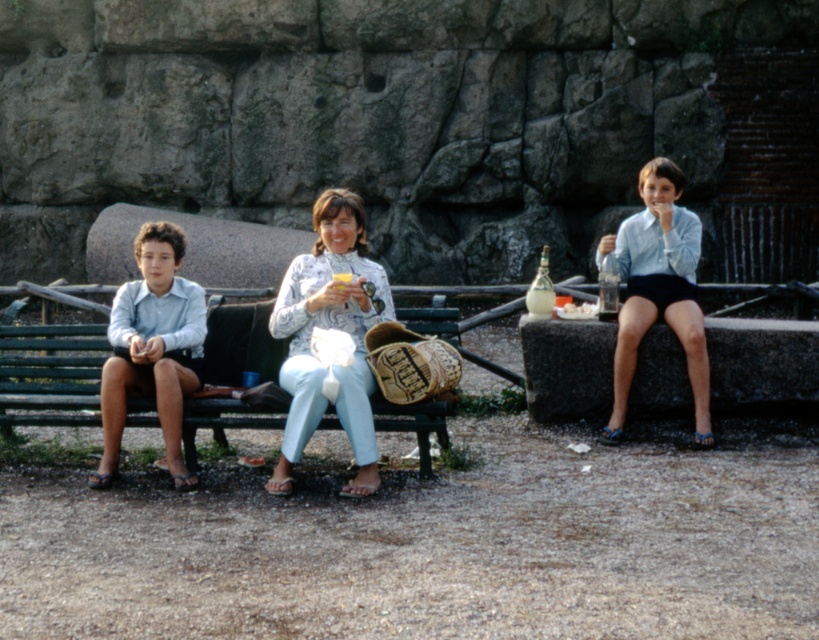
Based on the photo, you are a tailor measuring the distance between the light blue denim jeans at center and the patterned fabric blouse at center for a custom fitting. Can you fit a 1 inch wide ribbon between them?

The distance between the light blue denim jeans at center and the patterned fabric blouse at center is 0.97 inches, which is slightly less than 1 inch. Therefore, the ribbon cannot fit between them.

You are standing at the camera position and want to hand a toy to the matte blue shirt at left. Can you reach them without moving from your current position?

The matte blue shirt at left is 8.44 meters away from the camera, so you cannot reach them without moving from your current position.